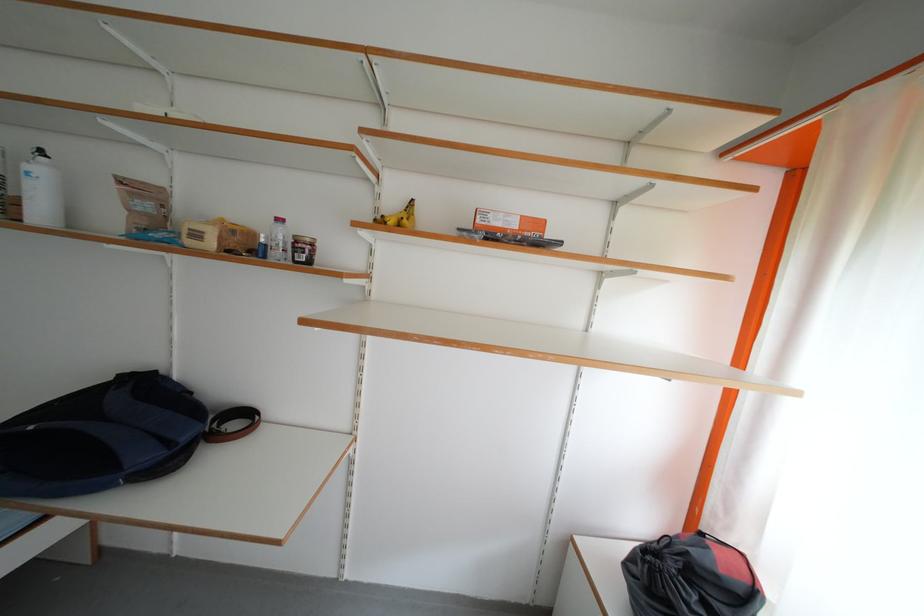
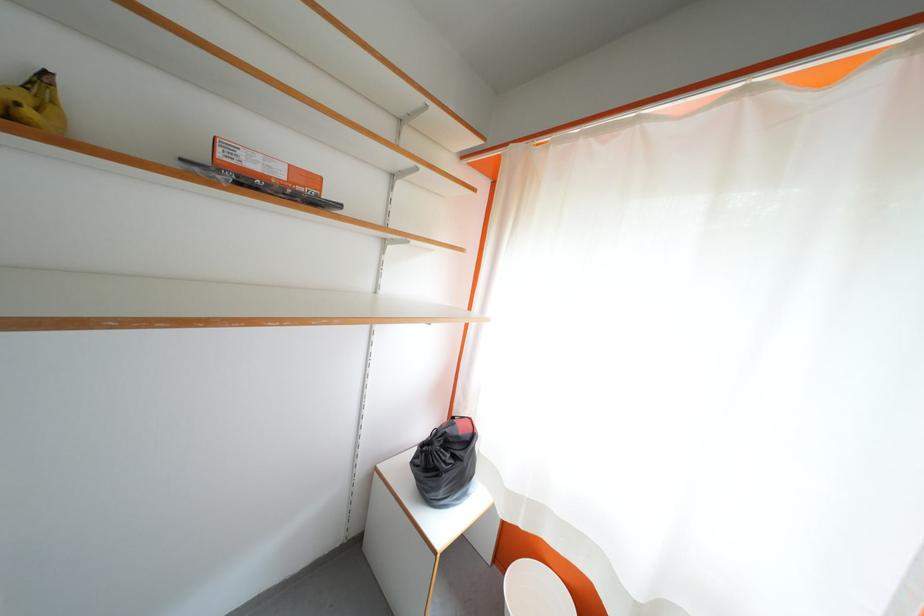
In the second image, find the point that corresponds to pixel 414 224 in the first image.

(38, 115)